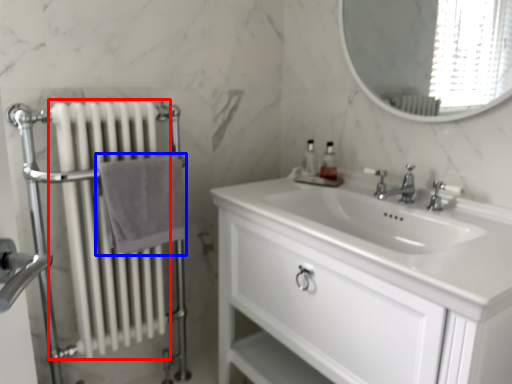
Question: Among these objects, which one is farthest to the camera, radiator (highlighted by a red box) or bath towel (highlighted by a blue box)?

Choices:
 (A) radiator
 (B) bath towel

Answer: (B)